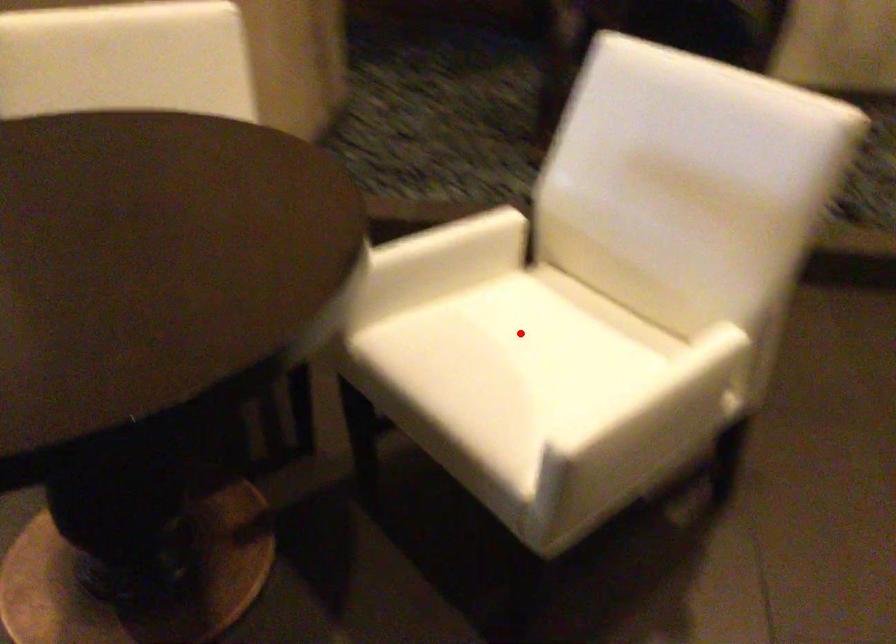
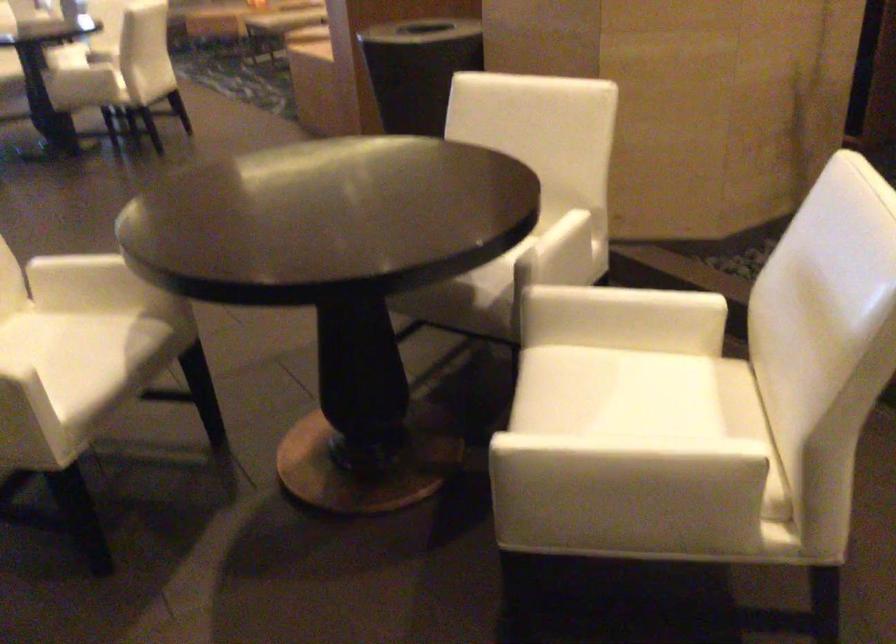
Question: A red point is marked in image1. In image2, is the corresponding 3D point closer to the camera or farther? Reply with the corresponding letter.

Choices:
 (A) The corresponding 3D point is closer.
 (B) The corresponding 3D point is farther.

Answer: (B)